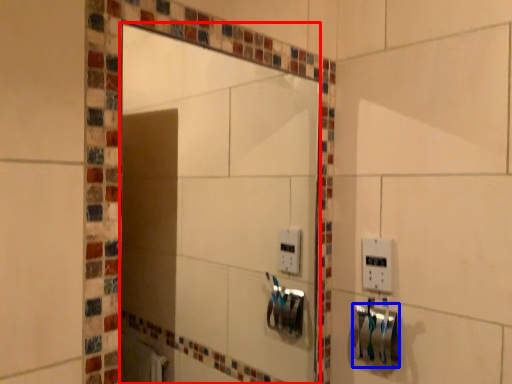
Question: Among these objects, which one is farthest to the camera, mirror (highlighted by a red box) or towel bar (highlighted by a blue box)?

Choices:
 (A) mirror
 (B) towel bar

Answer: (B)